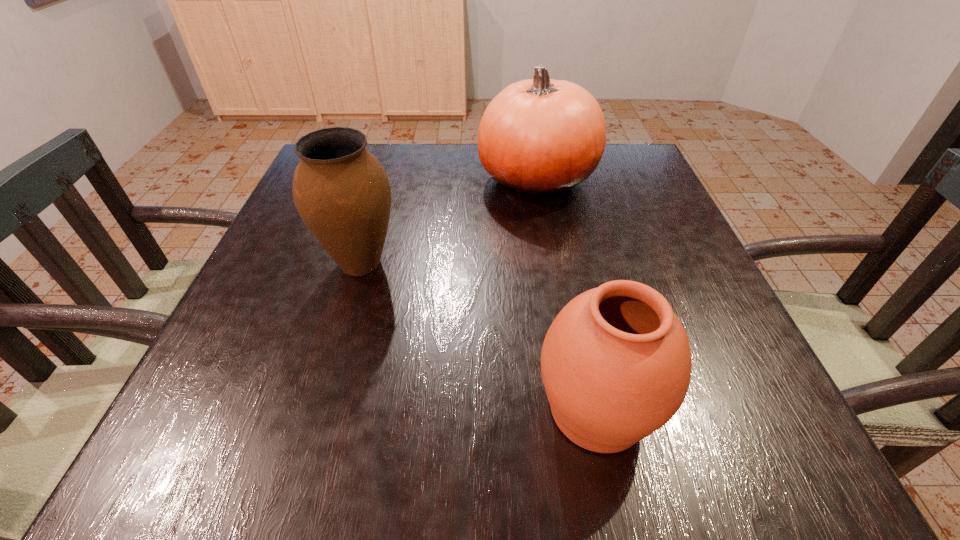
Where is `empty space between the left urn and the shortest object`? This screenshot has height=540, width=960. empty space between the left urn and the shortest object is located at coordinates (479, 336).

Identify the location of vacant space that is in between the pumpkin and the farther urn. Image resolution: width=960 pixels, height=540 pixels. [448, 221].

Find the location of a particular element. free space between the pumpkin and the right urn is located at coordinates (566, 294).

Locate an element on the screen. The image size is (960, 540). free area in between the second farthest object and the right urn is located at coordinates (479, 336).

The height and width of the screenshot is (540, 960). I want to click on free space that is in between the second nearest object and the shortest object, so click(479, 336).

Where is `empty location between the farther urn and the right urn`? The image size is (960, 540). empty location between the farther urn and the right urn is located at coordinates (479, 336).

The width and height of the screenshot is (960, 540). What are the coordinates of `unoccupied position between the pumpkin and the left urn` in the screenshot? It's located at (448, 221).

Locate an element on the screen. The width and height of the screenshot is (960, 540). free spot between the pumpkin and the shortest object is located at coordinates (566, 294).

Identify which object is the closest to the second farthest object. Please provide its 2D coordinates. Your answer should be formatted as a tuple, i.e. [(x, y)], where the tuple contains the x and y coordinates of a point satisfying the conditions above.

[(540, 137)]

Locate which object ranks second in proximity to the left urn. Please provide its 2D coordinates. Your answer should be formatted as a tuple, i.e. [(x, y)], where the tuple contains the x and y coordinates of a point satisfying the conditions above.

[(616, 363)]